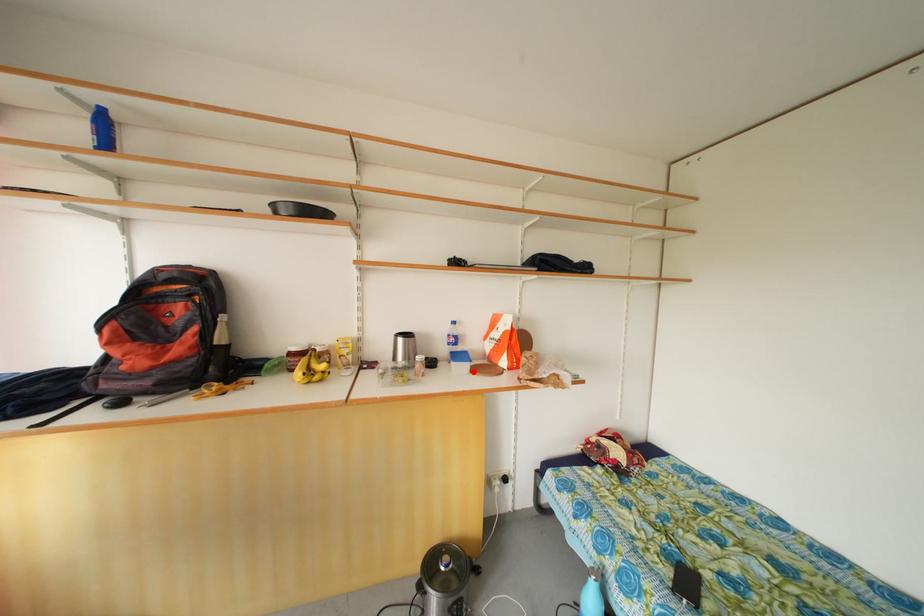
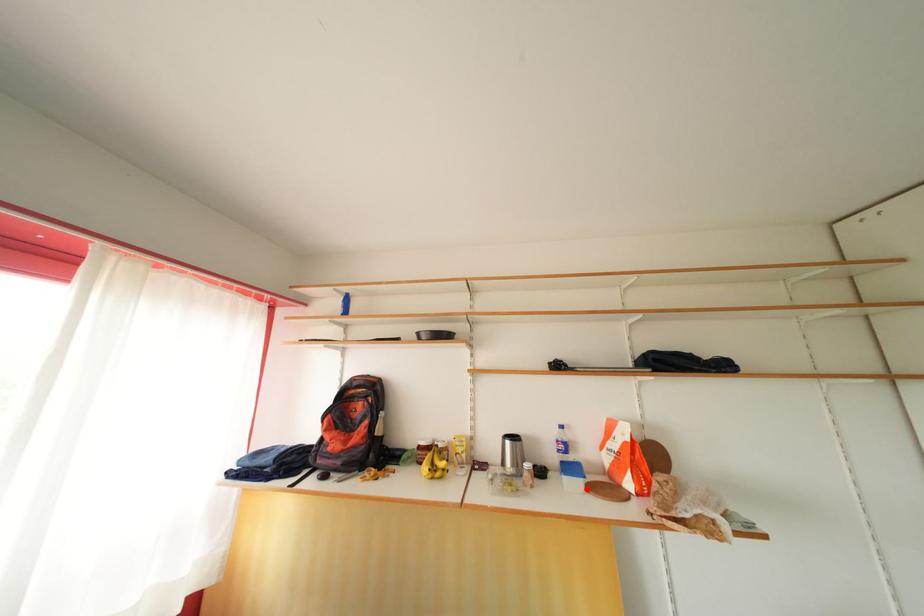
I am providing you with two images of the same scene from different viewpoints. A red point is marked on the first image and another point is marked on the second image. Do the highlighted points in image1 and image2 indicate the same real-world spot?

Yes